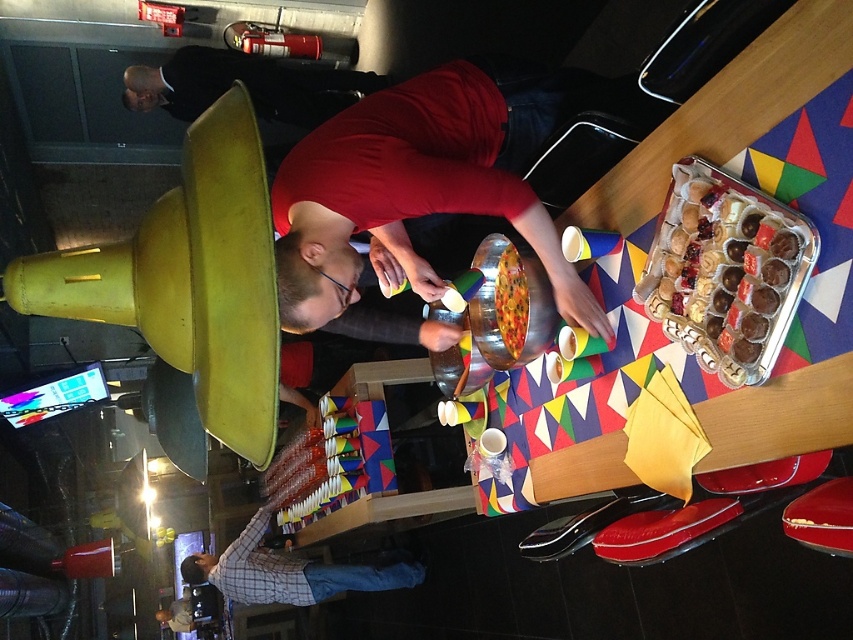
Question: Which point is farther to the camera?

Choices:
 (A) metallic silver tray of assorted chocolates at right
 (B) matte red shirt at center

Answer: (B)

Question: Can you confirm if plaid shirt at lower center is positioned to the left of multicolored plastic tray of assorted snacks at center?

Choices:
 (A) yes
 (B) no

Answer: (A)

Question: Which point is farther to the camera?

Choices:
 (A) (225, 552)
 (B) (437, 284)

Answer: (A)

Question: Is matte red shirt at center below plaid shirt at lower center?

Choices:
 (A) no
 (B) yes

Answer: (A)

Question: Does plaid shirt at lower center have a lesser width compared to multicolored plastic tray of assorted snacks at center?

Choices:
 (A) yes
 (B) no

Answer: (B)

Question: Which point appears farthest from the camera in this image?

Choices:
 (A) (302, 241)
 (B) (173, 60)

Answer: (B)